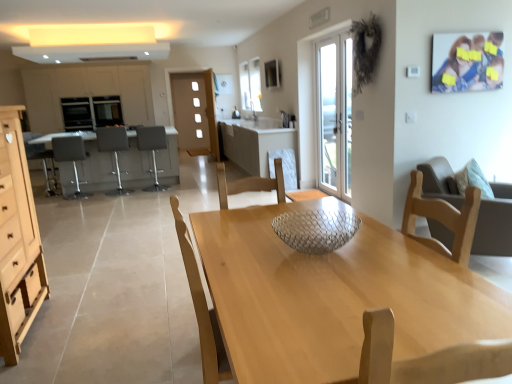
Question: Considering the positions of white marble cabinet at center, which is counted as the second cabinetry, starting from the back, and light wood dresser at left, which is counted as the 1th cabinetry, starting from the front, in the image, is white marble cabinet at center, which is counted as the second cabinetry, starting from the back, taller or shorter than light wood dresser at left, which is counted as the 1th cabinetry, starting from the front,?

Choices:
 (A) short
 (B) tall

Answer: (A)

Question: Is white marble cabinet at center, which is counted as the second cabinetry, starting from the back, in front of or behind light wood dresser at left, the second cabinetry viewed from the right, in the image?

Choices:
 (A) front
 (B) behind

Answer: (B)

Question: Which of these objects is positioned farthest from the matte black oven at left, placed as the 1th appliance when sorted from right to left?

Choices:
 (A) matte brown drawer at lower left, the 1th drawer in the back-to-front sequence
 (B) gray fabric bar stool at left, which is the 2th chair from front to back
 (C) white glass door at center
 (D) light wood dresser at left, the second cabinetry viewed from the right
 (E) wooden drawer at lower left, arranged as the 2th drawer when viewed from the back

Answer: (E)

Question: Estimate the real-world distances between objects in this image. Which object is closer to the clear glass bowl at center?

Choices:
 (A) matte black oven at left, placed as the 1th appliance when sorted from right to left
 (B) white marble cabinet at center, which appears as the first cabinetry when viewed from the right
 (C) gray fabric bar stool at left, which is counted as the fourth chair, starting from the back
 (D) wooden drawer at lower left, which is counted as the 1th drawer, starting from the front
 (E) white glass door at center

Answer: (D)